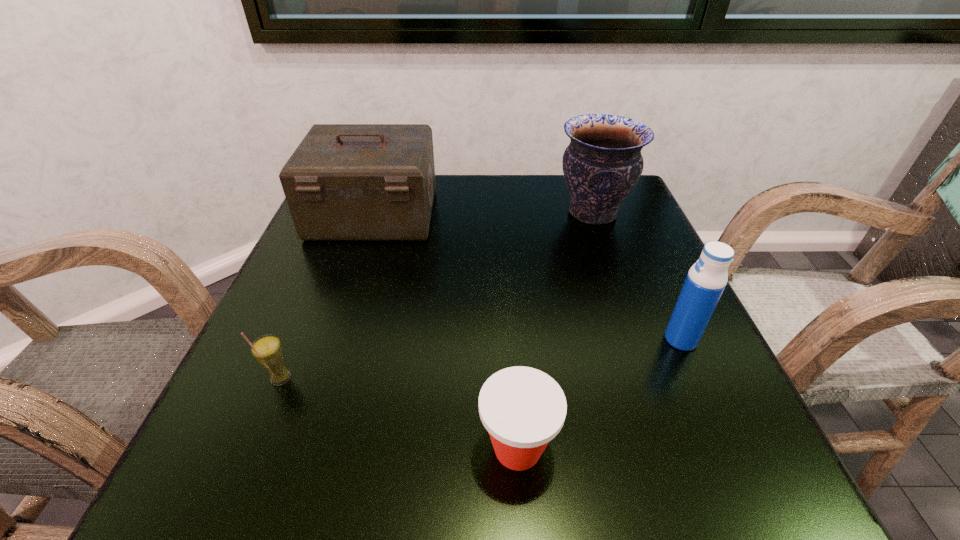
Where is `object that is at the far left corner`? object that is at the far left corner is located at coordinates (344, 182).

Identify the location of object at the far right corner. (602, 164).

Locate an element on the screen. The height and width of the screenshot is (540, 960). vacant space at the far edge of the desktop is located at coordinates (532, 210).

At what (x,y) coordinates should I click in order to perform the action: click on free space at the near edge of the desktop. Please return your answer as a coordinate pair (x, y). This screenshot has height=540, width=960. Looking at the image, I should click on (604, 470).

This screenshot has width=960, height=540. Find the location of `vacant space at the left edge of the desktop`. vacant space at the left edge of the desktop is located at coordinates (345, 285).

The height and width of the screenshot is (540, 960). I want to click on free region at the right edge, so (623, 322).

Where is `free space at the near left corner of the desktop`? free space at the near left corner of the desktop is located at coordinates (x=262, y=477).

This screenshot has width=960, height=540. In the image, there is a desktop. In order to click on vacant area at the near right corner in this screenshot , I will do `click(684, 440)`.

This screenshot has width=960, height=540. What are the coordinates of `free area in between the third nearest object and the fourth farthest object` in the screenshot? It's located at (481, 359).

In order to click on free space between the straw for drinking and the pottery in this screenshot , I will do `click(437, 295)`.